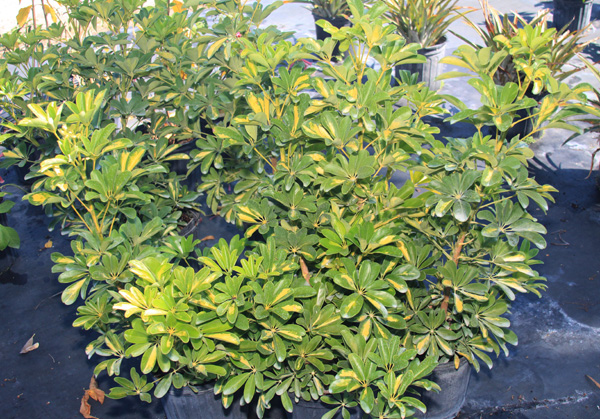
I want to click on plant, so click(x=365, y=238).